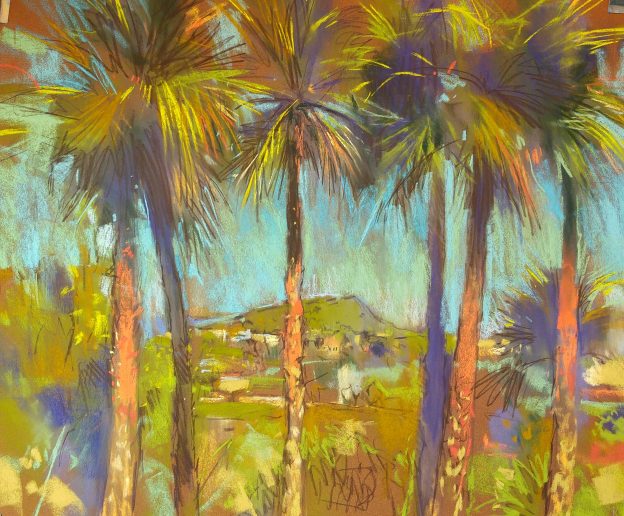
Find the location of a particular element. The width and height of the screenshot is (624, 516). scribbles on painting is located at coordinates (351, 494).